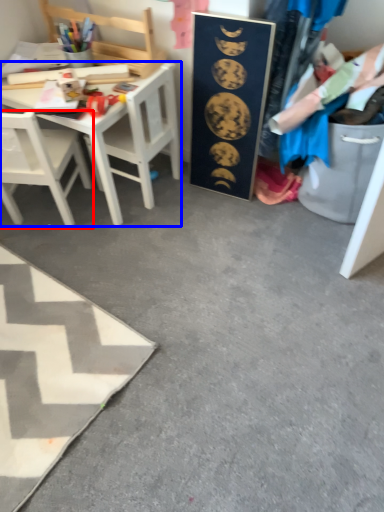
Question: Which of the following is the farthest to the observer, chair (highlighted by a red box) or desk (highlighted by a blue box)?

Choices:
 (A) chair
 (B) desk

Answer: (B)